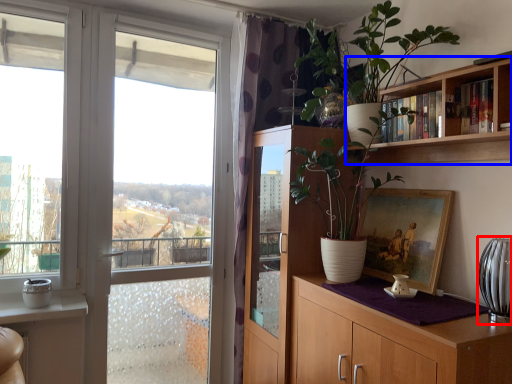
Question: Among these objects, which one is nearest to the camera, glass vase (highlighted by a red box) or bookcase (highlighted by a blue box)?

Choices:
 (A) glass vase
 (B) bookcase

Answer: (B)